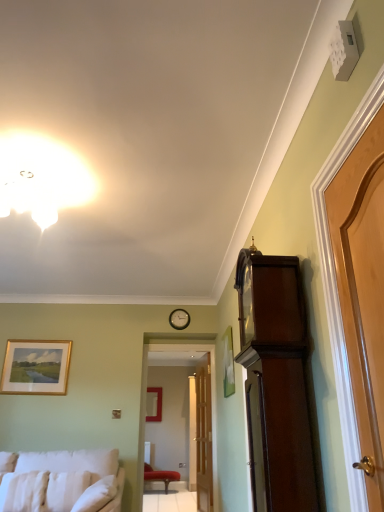
Measure the distance between point (105, 479) and camera.

The distance of point (105, 479) from camera is 12.39 feet.

In order to face white fluffy pillow at lower left, the second pillow positioned from the left, should I rotate leftwards or rightwards?

Rotate left and turn 16.457 degrees.

Locate an element on the screen. Image resolution: width=384 pixels, height=512 pixels. white glossy light fixture at upper center is located at coordinates (41, 178).

Identify the location of white soft pillow at lower left, positioned as the first pillow in left-to-right order. This screenshot has width=384, height=512. (23, 490).

The image size is (384, 512). In order to click on matte gold picture frame at lower left, the 1th picture frame viewed from the left in this screenshot , I will do `click(36, 367)`.

Does white fluffy pillow at lower left, the second pillow from the right, have a smaller size compared to matte gold picture frame at lower left, the 2th picture frame ordered from the bottom?

No, white fluffy pillow at lower left, the second pillow from the right, is not smaller than matte gold picture frame at lower left, the 2th picture frame ordered from the bottom.

Is white fluffy pillow at lower left, the second pillow from the right, turned away from matte gold picture frame at lower left, arranged as the 2th picture frame when viewed from the right?

No, white fluffy pillow at lower left, the second pillow from the right, is not facing away from matte gold picture frame at lower left, arranged as the 2th picture frame when viewed from the right.

Which object is closer to the camera taking this photo, white fluffy pillow at lower left, the second pillow positioned from the left, or matte gold picture frame at lower left, the 2th picture frame ordered from the bottom?

white fluffy pillow at lower left, the second pillow positioned from the left, is in front.

Considering the relative sizes of white fluffy pillow at lower left, the second pillow positioned from the left, and matte gold picture frame at lower left, which is the first picture frame from front to back, in the image provided, is white fluffy pillow at lower left, the second pillow positioned from the left, taller than matte gold picture frame at lower left, which is the first picture frame from front to back,?

Incorrect, the height of white fluffy pillow at lower left, the second pillow positioned from the left, is not larger of that of matte gold picture frame at lower left, which is the first picture frame from front to back.

From the picture: From a real-world perspective, is mahogany wood grandfather clock at right below light brown wooden door at right, the first door when ordered from right to left?

Yes, from a real-world perspective, mahogany wood grandfather clock at right is below light brown wooden door at right, the first door when ordered from right to left.

How far apart are mahogany wood grandfather clock at right and light brown wooden door at right, the first door positioned from the front?

mahogany wood grandfather clock at right is 17.73 inches from light brown wooden door at right, the first door positioned from the front.

Can you confirm if mahogany wood grandfather clock at right is smaller than light brown wooden door at right, which ranks as the first door in top-to-bottom order?

Incorrect, mahogany wood grandfather clock at right is not smaller in size than light brown wooden door at right, which ranks as the first door in top-to-bottom order.

Is mahogany wood grandfather clock at right taller than light brown wooden door at right, which ranks as the first door in top-to-bottom order?

Indeed, mahogany wood grandfather clock at right has a greater height compared to light brown wooden door at right, which ranks as the first door in top-to-bottom order.

From a real-world perspective, is white soft pillow at lower left, positioned as the 1th pillow in right-to-left order, positioned above or below matte gold picture frame at center, placed as the 1th picture frame when sorted from bottom to top?

From a real-world perspective, white soft pillow at lower left, positioned as the 1th pillow in right-to-left order, is physically below matte gold picture frame at center, placed as the 1th picture frame when sorted from bottom to top.

Considering the relative sizes of white soft pillow at lower left, which is counted as the 3th pillow, starting from the left, and matte gold picture frame at center, which appears as the 1th picture frame when viewed from the back, in the image provided, is white soft pillow at lower left, which is counted as the 3th pillow, starting from the left, shorter than matte gold picture frame at center, which appears as the 1th picture frame when viewed from the back,?

Indeed, white soft pillow at lower left, which is counted as the 3th pillow, starting from the left, has a lesser height compared to matte gold picture frame at center, which appears as the 1th picture frame when viewed from the back.

Is white soft pillow at lower left, which is counted as the 3th pillow, starting from the left, aimed at matte gold picture frame at center, which is the second picture frame from left to right?

No.

Would you say white soft pillow at lower left, which is counted as the 3th pillow, starting from the left, is outside matte gold picture frame at center, which is the second picture frame from left to right?

Absolutely, white soft pillow at lower left, which is counted as the 3th pillow, starting from the left, is external to matte gold picture frame at center, which is the second picture frame from left to right.

Considering the relative positions of white fabric studio couch at lower left and mahogany wood grandfather clock at right in the image provided, is white fabric studio couch at lower left to the right of mahogany wood grandfather clock at right from the viewer's perspective?

No, white fabric studio couch at lower left is not to the right of mahogany wood grandfather clock at right.

What's the angular difference between white fabric studio couch at lower left and mahogany wood grandfather clock at right's facing directions?

The facing directions of white fabric studio couch at lower left and mahogany wood grandfather clock at right are 90.9 degrees apart.

From a real-world perspective, is white fabric studio couch at lower left over mahogany wood grandfather clock at right?

No.

Can you confirm if white fabric studio couch at lower left is thinner than mahogany wood grandfather clock at right?

Incorrect, the width of white fabric studio couch at lower left is not less than that of mahogany wood grandfather clock at right.

Which object is closer to the camera, matte gold picture frame at lower left, arranged as the 2th picture frame when viewed from the right, or matte gold picture frame at center, the 2th picture frame from the top?

Positioned in front is matte gold picture frame at lower left, arranged as the 2th picture frame when viewed from the right.

Which of these two, matte gold picture frame at lower left, which is the first picture frame from front to back, or matte gold picture frame at center, which is the second picture frame from left to right, is smaller?

With smaller size is matte gold picture frame at lower left, which is the first picture frame from front to back.

Considering the sizes of objects matte gold picture frame at lower left, the 1th picture frame viewed from the left, and matte gold picture frame at center, placed as the 1th picture frame when sorted from bottom to top, in the image provided, who is thinner, matte gold picture frame at lower left, the 1th picture frame viewed from the left, or matte gold picture frame at center, placed as the 1th picture frame when sorted from bottom to top,?

matte gold picture frame at lower left, the 1th picture frame viewed from the left, is thinner.

Is mahogany wood grandfather clock at right to the left or to the right of matte gold picture frame at center, placed as the 1th picture frame when sorted from bottom to top, in the image?

mahogany wood grandfather clock at right is to the right of matte gold picture frame at center, placed as the 1th picture frame when sorted from bottom to top.

What's the angular difference between mahogany wood grandfather clock at right and matte gold picture frame at center, which appears as the 1th picture frame when viewed from the back,'s facing directions?

The angle between the facing direction of mahogany wood grandfather clock at right and the facing direction of matte gold picture frame at center, which appears as the 1th picture frame when viewed from the back, is 87.9 degrees.

Who is shorter, mahogany wood grandfather clock at right or matte gold picture frame at center, which appears as the 1th picture frame when viewed from the back?

matte gold picture frame at center, which appears as the 1th picture frame when viewed from the back.

From a real-world perspective, between mahogany wood grandfather clock at right and matte gold picture frame at center, the 2th picture frame from the top, who is vertically lower?

mahogany wood grandfather clock at right.

Is wooden clock at center completely or partially outside of matte gold picture frame at lower left, acting as the first picture frame starting from the top?

Yes, wooden clock at center is outside of matte gold picture frame at lower left, acting as the first picture frame starting from the top.

Could you tell me if wooden clock at center is turned towards matte gold picture frame at lower left, the 2th picture frame ordered from the bottom?

No.

From a real-world perspective, is wooden clock at center positioned above or below matte gold picture frame at lower left, the 2th picture frame ordered from the bottom?

wooden clock at center is situated higher than matte gold picture frame at lower left, the 2th picture frame ordered from the bottom, in the real world.

Does wooden clock at center have a lesser height compared to matte gold picture frame at lower left, arranged as the 2th picture frame when viewed from the right?

Indeed, wooden clock at center has a lesser height compared to matte gold picture frame at lower left, arranged as the 2th picture frame when viewed from the right.

Identify the location of the 2nd picture frame above the white fluffy pillow at lower left, the second pillow from the right (from a real-world perspective). The image size is (384, 512). (36, 367).

Where is `cabinetry that appears behind the light brown wooden door at right, which ranks as the first door in top-to-bottom order`? The image size is (384, 512). cabinetry that appears behind the light brown wooden door at right, which ranks as the first door in top-to-bottom order is located at coordinates (277, 382).

Based on the photo, considering their positions, is transparent glass door at center positioned closer to wooden clock at center than matte gold picture frame at center, the 2th picture frame when ordered from front to back?

Based on the image, transparent glass door at center appears to be nearer to wooden clock at center.

Which object lies further to the anchor point mahogany wood grandfather clock at right, light brown wooden door at right, the 2th door from the left, or matte gold picture frame at center, placed as the 1th picture frame when sorted from bottom to top?

matte gold picture frame at center, placed as the 1th picture frame when sorted from bottom to top, is positioned further to the anchor mahogany wood grandfather clock at right.

Based on their spatial positions, is white soft pillow at lower left, positioned as the 1th pillow in right-to-left order, or light brown wooden door at center, the first door from the bottom, closer to white fluffy pillow at lower left, the second pillow from the right?

The object closer to white fluffy pillow at lower left, the second pillow from the right, is white soft pillow at lower left, positioned as the 1th pillow in right-to-left order.

When comparing their distances from light brown wooden door at right, the first door when ordered from right to left, does white soft pillow at lower left, which is counted as the 3th pillow, starting from the left, or white fluffy pillow at lower left, the second pillow positioned from the left, seem further?

white fluffy pillow at lower left, the second pillow positioned from the left, lies further to light brown wooden door at right, the first door when ordered from right to left, than the other object.

Estimate the real-world distances between objects in this image. Which object is closer to matte gold picture frame at center, the 2th picture frame when ordered from front to back, white glossy light fixture at upper center or velvet red chair at center?

velvet red chair at center is closer to matte gold picture frame at center, the 2th picture frame when ordered from front to back.

When comparing their distances from matte gold picture frame at lower left, arranged as the 2th picture frame when viewed from the right, does white glossy light fixture at upper center or transparent glass door at center seem closer?

Based on the image, transparent glass door at center appears to be nearer to matte gold picture frame at lower left, arranged as the 2th picture frame when viewed from the right.

Looking at the image, which one is located further to wooden clock at center, transparent glass door at center or matte gold picture frame at lower left, which appears as the 2th picture frame when viewed from the back?

The object further to wooden clock at center is transparent glass door at center.

Which object lies further to the anchor point mahogany wood grandfather clock at right, transparent glass door at center or white soft pillow at lower left, positioned as the 1th pillow in right-to-left order?

Based on the image, transparent glass door at center appears to be further to mahogany wood grandfather clock at right.

Find the location of a particular element. The image size is (384, 512). door between matte gold picture frame at lower left, acting as the first picture frame starting from the top, and velvet red chair at center from front to back is located at coordinates (204, 437).

Where is `studio couch located between light brown wooden door at right, the 2th door from the left, and white soft pillow at lower left, which is counted as the 3th pillow, starting from the right, in the depth direction`? The image size is (384, 512). studio couch located between light brown wooden door at right, the 2th door from the left, and white soft pillow at lower left, which is counted as the 3th pillow, starting from the right, in the depth direction is located at coordinates (61, 481).

Image resolution: width=384 pixels, height=512 pixels. I want to click on cabinetry located between light brown wooden door at right, the first door when ordered from right to left, and velvet red chair at center in the depth direction, so click(x=277, y=382).

The width and height of the screenshot is (384, 512). What are the coordinates of `clock located between white soft pillow at lower left, which is counted as the 3th pillow, starting from the right, and transparent glass door at center in the left-right direction` in the screenshot? It's located at point(179,319).